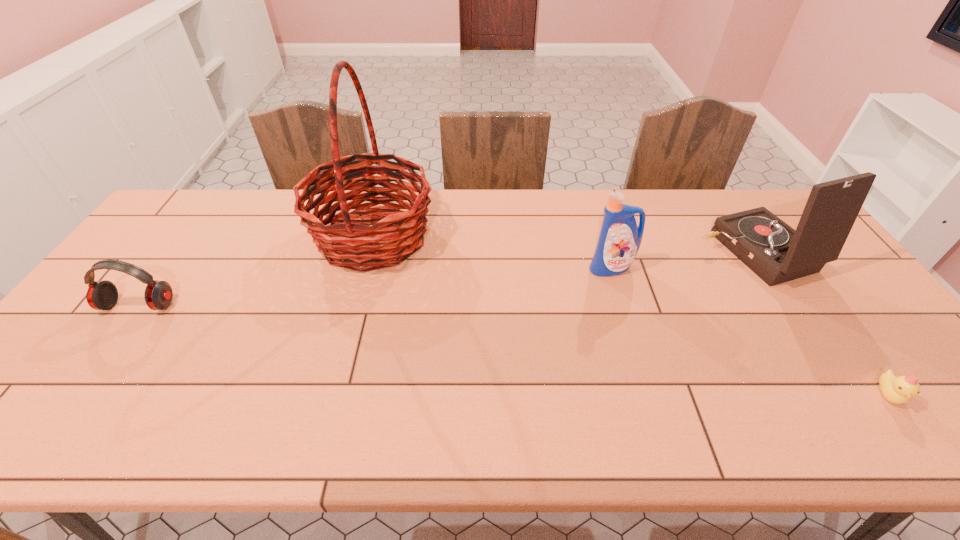
Where is `the tallest object`? The width and height of the screenshot is (960, 540). the tallest object is located at coordinates (347, 242).

Where is `basket`? Image resolution: width=960 pixels, height=540 pixels. basket is located at coordinates (347, 242).

I want to click on phonograph record, so click(774, 251).

I want to click on the third object from left to right, so click(x=619, y=240).

You are a GUI agent. You are given a task and a screenshot of the screen. Output one action in this format:
    pyautogui.click(x=<x>, y=<y>)
    Task: Click on the third tallest object
    The height and width of the screenshot is (540, 960).
    Given the screenshot: What is the action you would take?
    pyautogui.click(x=619, y=240)

The image size is (960, 540). I want to click on the second shortest object, so click(101, 295).

The height and width of the screenshot is (540, 960). Find the location of `the fourth farthest object`. the fourth farthest object is located at coordinates [101, 295].

What are the coordinates of `duckling` in the screenshot? It's located at (898, 390).

The image size is (960, 540). I want to click on the nearest object, so click(898, 390).

I want to click on free location located on the right of the basket, so click(459, 237).